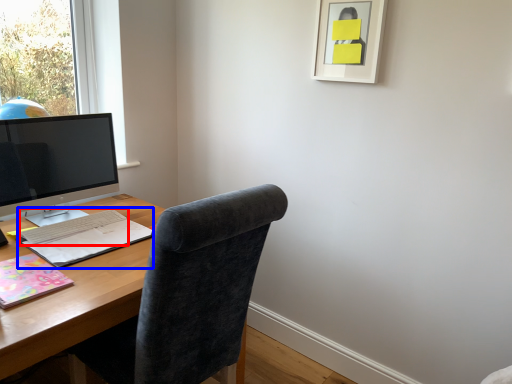
Question: Which of the following is the closest to the observer, computer keyboard (highlighted by a red box) or notebook (highlighted by a blue box)?

Choices:
 (A) computer keyboard
 (B) notebook

Answer: (B)